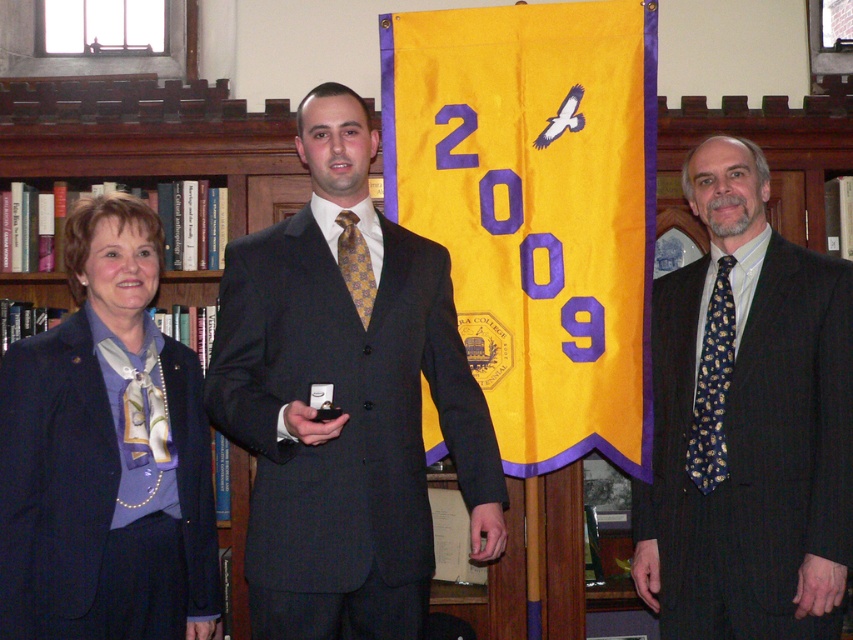
Who is shorter, dark gray suit at right or purple satin blazer at left?

purple satin blazer at left is shorter.

Does dark gray suit at right have a smaller size compared to purple satin blazer at left?

Incorrect, dark gray suit at right is not smaller in size than purple satin blazer at left.

Which is in front, point (831, 525) or point (45, 371)?

Point (45, 371) is more forward.

Locate an element on the screen. This screenshot has width=853, height=640. dark gray suit at right is located at coordinates (747, 422).

From the picture: Does yellow fabric banner at center appear on the left side of dark gray suit at right?

Indeed, yellow fabric banner at center is positioned on the left side of dark gray suit at right.

Is yellow fabric banner at center above dark gray suit at right?

Indeed, yellow fabric banner at center is positioned over dark gray suit at right.

Identify the location of yellow fabric banner at center. (535, 209).

I want to click on yellow fabric banner at center, so click(535, 209).

Can you confirm if yellow fabric banner at center is positioned above purple satin blazer at left?

Yes, yellow fabric banner at center is above purple satin blazer at left.

Who is more distant from viewer, (602,209) or (138,230)?

The point (602,209) is more distant.

Locate an element on the screen. yellow fabric banner at center is located at coordinates (535, 209).